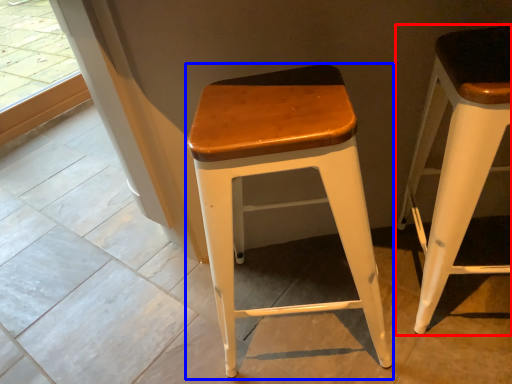
Question: Among these objects, which one is farthest to the camera, stool (highlighted by a red box) or stool (highlighted by a blue box)?

Choices:
 (A) stool
 (B) stool

Answer: (B)